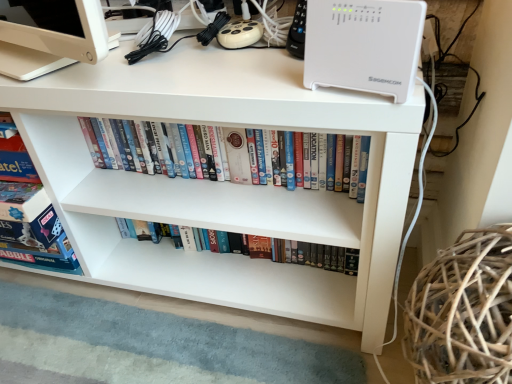
Question: From the image's perspective, is brown woven basket at lower right beneath white glossy bookshelf at center, the 1th book ordered from the bottom?

Choices:
 (A) no
 (B) yes

Answer: (B)

Question: Is brown woven basket at lower right placed right next to white glossy bookshelf at center, the 2th book viewed from the top?

Choices:
 (A) no
 (B) yes

Answer: (A)

Question: Does brown woven basket at lower right lie in front of white glossy bookshelf at center, the 1th book ordered from the bottom?

Choices:
 (A) no
 (B) yes

Answer: (B)

Question: Is the depth of brown woven basket at lower right greater than that of white glossy bookshelf at center, the 2th book viewed from the top?

Choices:
 (A) yes
 (B) no

Answer: (B)

Question: Can you confirm if brown woven basket at lower right is smaller than white glossy bookshelf at center, the 2th book viewed from the top?

Choices:
 (A) yes
 (B) no

Answer: (B)

Question: Would you say brown woven basket at lower right is outside white glossy bookshelf at center, the 1th book ordered from the bottom?

Choices:
 (A) yes
 (B) no

Answer: (A)

Question: Considering the relative sizes of brown woven basket at lower right and white matte desk at upper center in the image provided, is brown woven basket at lower right shorter than white matte desk at upper center?

Choices:
 (A) yes
 (B) no

Answer: (A)

Question: From a real-world perspective, is brown woven basket at lower right positioned under white matte desk at upper center based on gravity?

Choices:
 (A) yes
 (B) no

Answer: (B)

Question: From the image's perspective, does brown woven basket at lower right appear lower than white matte desk at upper center?

Choices:
 (A) yes
 (B) no

Answer: (A)

Question: Considering the relative positions of brown woven basket at lower right and white matte desk at upper center in the image provided, is brown woven basket at lower right to the right of white matte desk at upper center from the viewer's perspective?

Choices:
 (A) no
 (B) yes

Answer: (B)

Question: Is brown woven basket at lower right far away from white matte desk at upper center?

Choices:
 (A) yes
 (B) no

Answer: (B)

Question: From a real-world perspective, is brown woven basket at lower right located higher than white matte desk at upper center?

Choices:
 (A) no
 (B) yes

Answer: (B)

Question: Does white glossy bookshelf at center, the 2th book viewed from the top, have a larger size compared to white plastic dvds at center, arranged as the first book when viewed from the top?

Choices:
 (A) no
 (B) yes

Answer: (A)